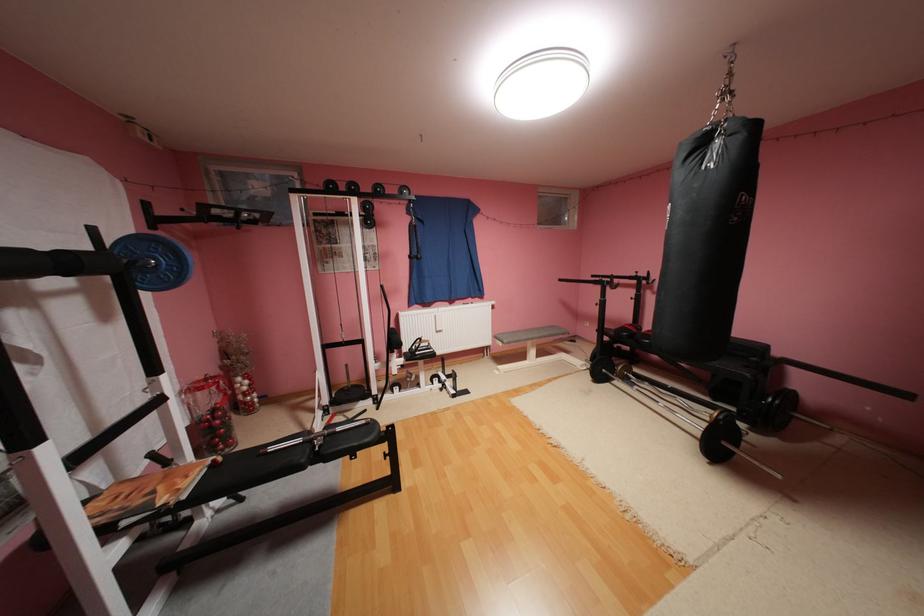
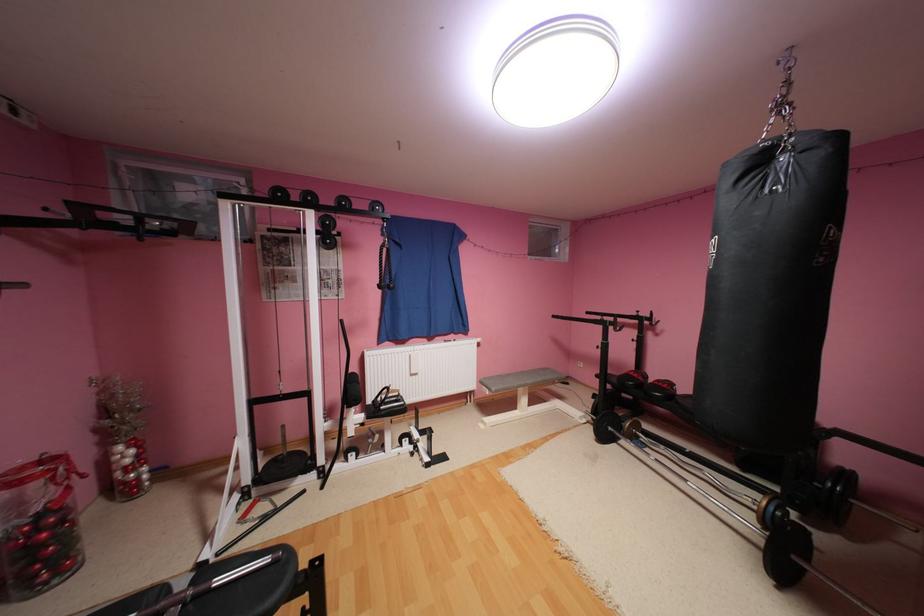
Where in the second image is the point corresponding to (383,391) from the first image?

(331, 460)